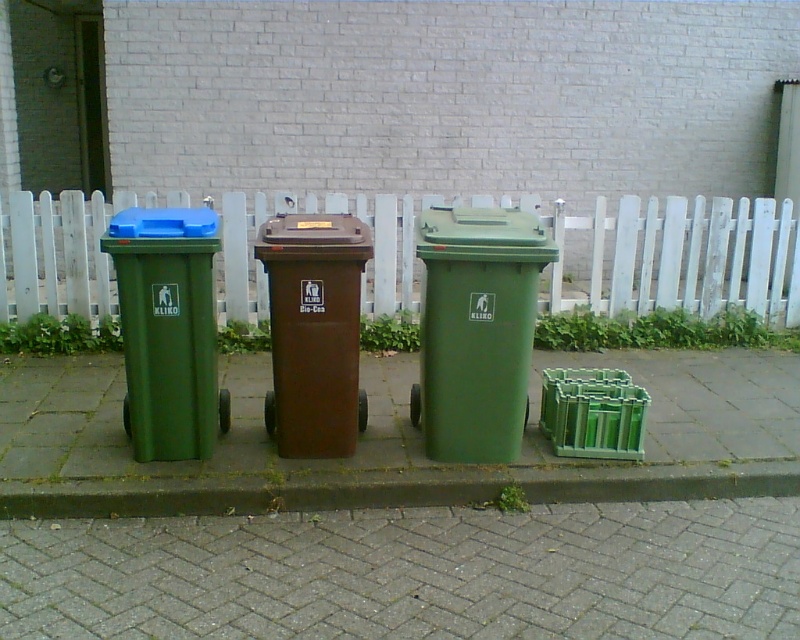
Is green plastic recycling bin at center positioned behind green concrete curb at lower center?

Yes, green plastic recycling bin at center is further from the viewer.

Does green plastic recycling bin at center have a lesser height compared to green concrete curb at lower center?

Incorrect, green plastic recycling bin at center's height does not fall short of green concrete curb at lower center's.

What do you see at coordinates (476, 330) in the screenshot?
I see `green plastic recycling bin at center` at bounding box center [476, 330].

I want to click on green plastic recycling bin at center, so click(476, 330).

Is point (304, 454) closer to camera compared to point (38, 513)?

No, it is behind (38, 513).

Can you confirm if brown matte/recycled plastic at center is thinner than green concrete curb at lower center?

Correct, brown matte/recycled plastic at center's width is less than green concrete curb at lower center's.

Which is behind, point (332, 328) or point (666, 499)?

Point (666, 499)

Identify the location of brown matte/recycled plastic at center. The image size is (800, 640). [x=314, y=332].

Who is shorter, gray brick pavement at lower center or green matte plastic recycling bin at left?

gray brick pavement at lower center is shorter.

Does gray brick pavement at lower center have a smaller size compared to green matte plastic recycling bin at left?

→ Incorrect, gray brick pavement at lower center is not smaller in size than green matte plastic recycling bin at left.

Who is more forward, (272, 564) or (178, 371)?

Point (272, 564)

At what (x,y) coordinates should I click in order to perform the action: click on gray brick pavement at lower center. Please return your answer as a coordinate pair (x, y). Looking at the image, I should click on (412, 573).